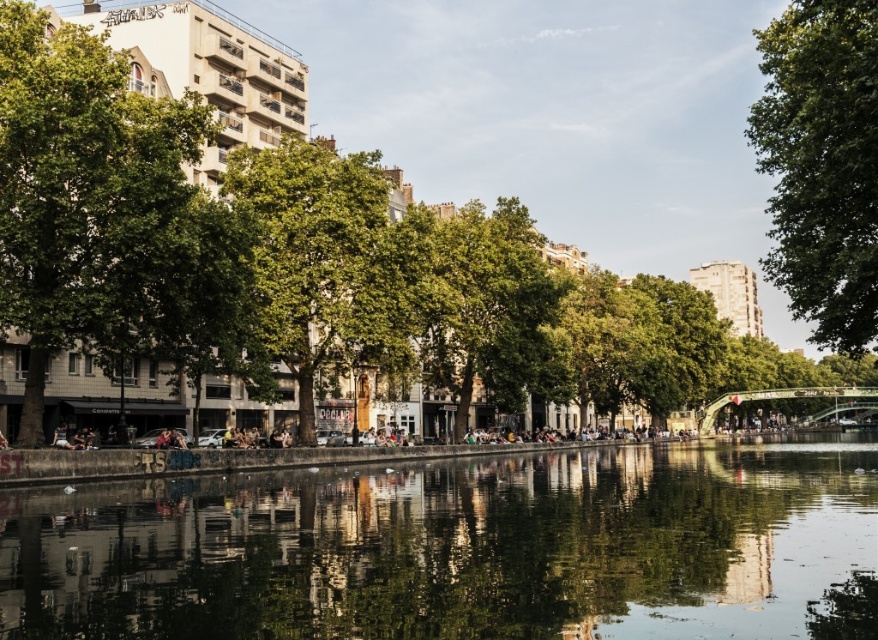
Question: Can you confirm if green leafy tree at center is positioned to the right of green leafy tree at left?

Choices:
 (A) yes
 (B) no

Answer: (A)

Question: Which is nearer to the green leafy tree at left?

Choices:
 (A) green leafy tree at upper right
 (B) green reflective water at center
 (C) green leafy tree at center

Answer: (C)

Question: Among these points, which one is farthest from the camera?

Choices:
 (A) (419, 515)
 (B) (156, 177)
 (C) (52, 252)

Answer: (B)

Question: Can you confirm if green reflective water at center is bigger than green leafy tree at upper right?

Choices:
 (A) no
 (B) yes

Answer: (A)

Question: Does green leafy tree at left have a smaller size compared to green leafy tree at upper right?

Choices:
 (A) yes
 (B) no

Answer: (A)

Question: Which is nearer to the green leafy tree at upper right?

Choices:
 (A) green leafy tree at center
 (B) green reflective water at center

Answer: (A)